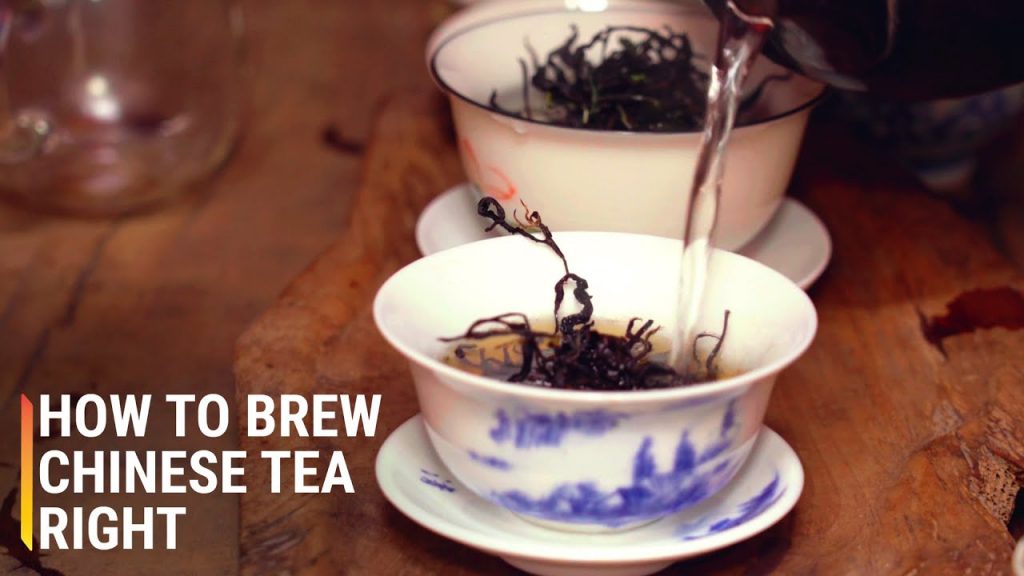
Find the location of a particular element. tea pot is located at coordinates (893, 59).